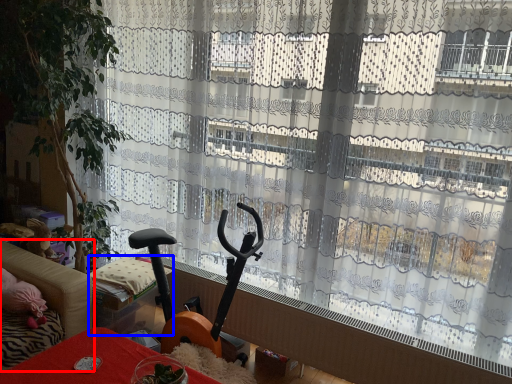
Question: Which object appears closest to the camera in this image, studio couch (highlighted by a red box) or furniture (highlighted by a blue box)?

Choices:
 (A) studio couch
 (B) furniture

Answer: (A)